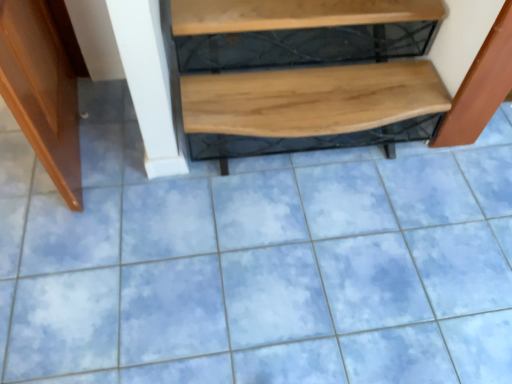
The height and width of the screenshot is (384, 512). I want to click on free space in front of natural wood bench at center, so click(x=313, y=286).